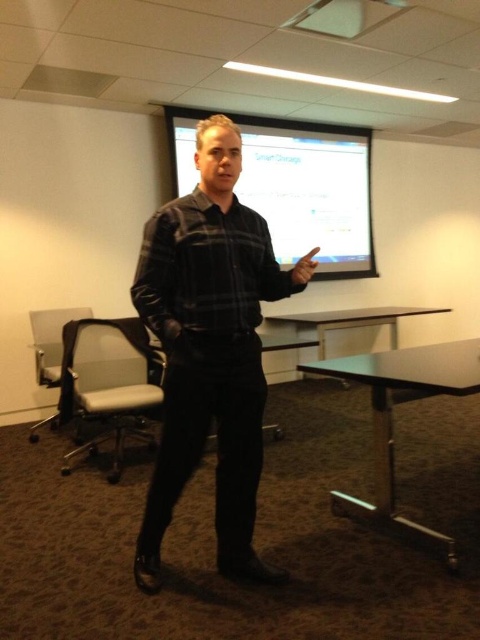
Which of these two, white plastic projector at upper center or white glossy table at lower center, stands shorter?

white plastic projector at upper center

Who is higher up, white plastic projector at upper center or white glossy table at lower center?

white plastic projector at upper center is above.

Where is `white plastic projector at upper center`? white plastic projector at upper center is located at coordinates (346, 17).

Who is higher up, black plaid shirt at center or black metal table at lower center?

black plaid shirt at center is higher up.

Does black plaid shirt at center have a lesser width compared to black metal table at lower center?

Correct, black plaid shirt at center's width is less than black metal table at lower center's.

Locate an element on the screen. Image resolution: width=480 pixels, height=640 pixels. black plaid shirt at center is located at coordinates (210, 348).

Based on the photo, does white glossy projection screen at upper center appear on the right side of gray fabric swivel chair at left?

Correct, you'll find white glossy projection screen at upper center to the right of gray fabric swivel chair at left.

Describe the element at coordinates (311, 189) in the screenshot. Image resolution: width=480 pixels, height=640 pixels. I see `white glossy projection screen at upper center` at that location.

I want to click on white glossy projection screen at upper center, so click(x=311, y=189).